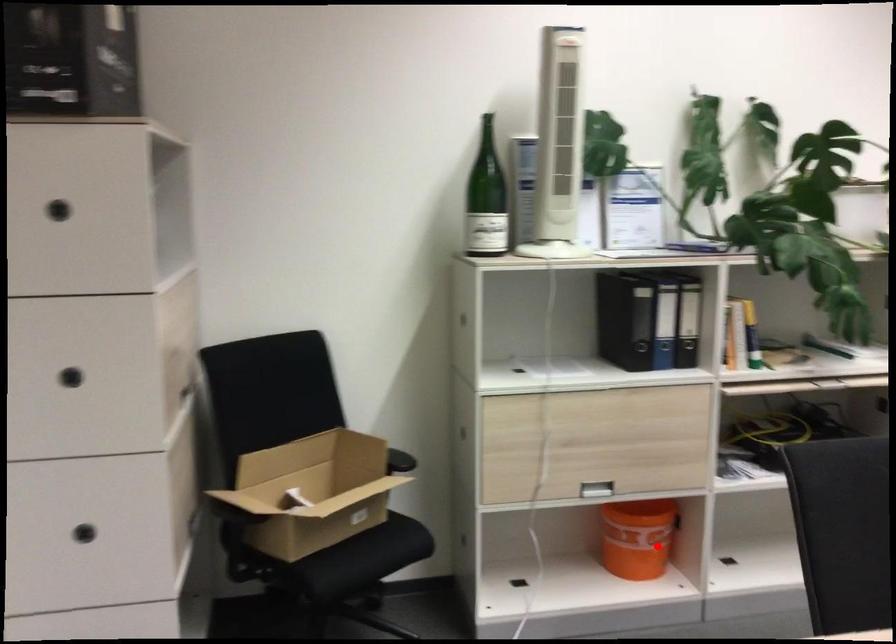
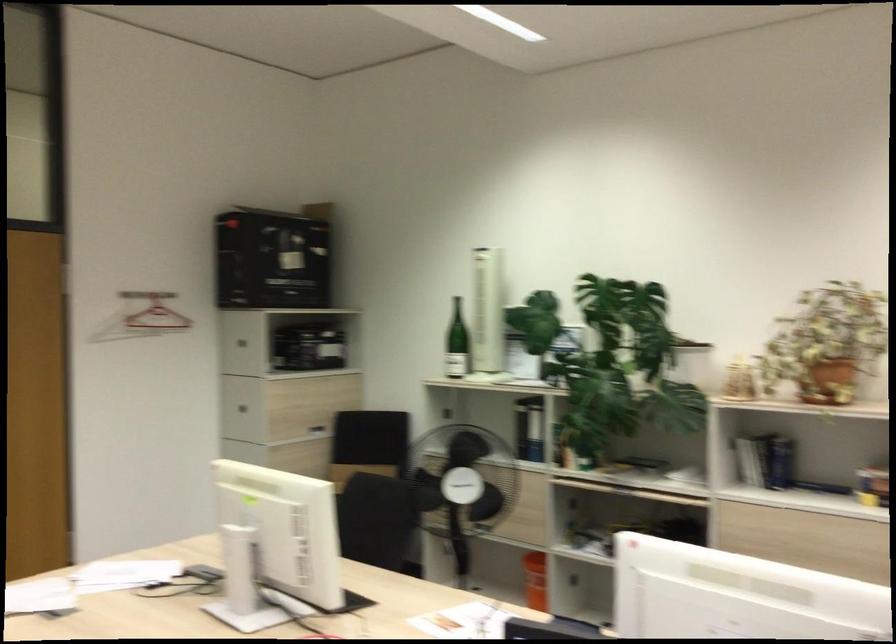
Question: A red point is marked in image1. In image2, is the corresponding 3D point closer to the camera or farther? Reply with the corresponding letter.

Choices:
 (A) The corresponding 3D point is closer.
 (B) The corresponding 3D point is farther.

Answer: (B)